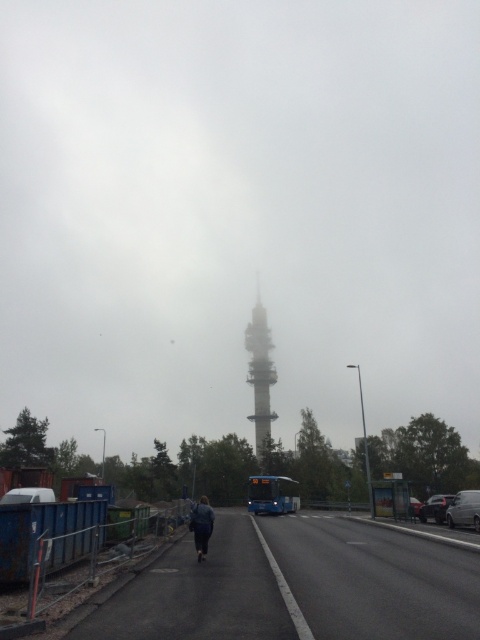
You are a delivery driver needing to park your vehicle in a narrow alley that can only accommodate vehicles up to the width of the metallic silver car at lower left. Given that your delivery van is the same size as the silver metallic van at center, will you be able to park there?

The silver metallic van at center is wider than the metallic silver car at lower left, so your delivery van, being the same size as the silver metallic van at center, will not fit in the narrow alley designed for vehicles up to the width of the metallic silver car at lower left.

You are a photographer trying to capture the foggy tower at center and the metallic silver sedan at right in the same frame. Given their sizes, which object will appear larger in your photo?

The foggy tower at center will appear larger in the photo because it is much taller than the metallic silver sedan at right.

You are a pedestrian standing on the road and want to cross to the other side. There is a shiny black car at lower right and a metallic silver sedan at right parked on the side. Which vehicle is taller and might block your view when you cross?

The shiny black car at lower right is much taller than the metallic silver sedan at right, so it might block your view more when crossing.